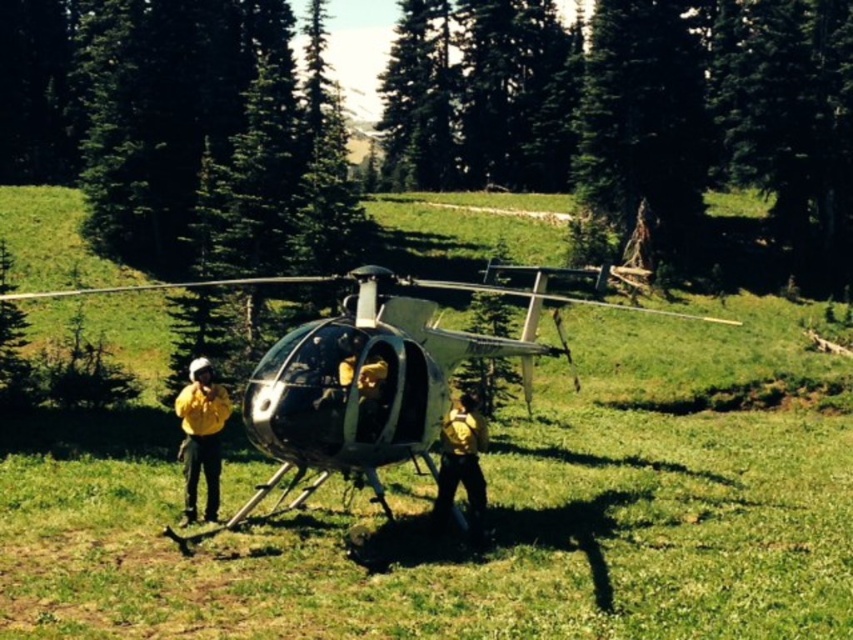
You are standing at the point labeled point (209, 493) and want to take a photo of the helicopter. If your camera has a maximum focus range of 50 feet, will you be able to capture the helicopter clearly?

The distance between point (209, 493) and the camera is 44.94 feet, which is within the camera maximum focus range of 50 feet. Therefore, you can capture the helicopter clearly.

You are a drone operator trying to land a small drone near the metallic silver helicopter at center without disturbing the yellow fireproof suit at left. Since the helicopter is positioned over the suit, where should you aim to land the drone?

The metallic silver helicopter at center is positioned over the yellow fireproof suit at left, so you should aim to land the drone on the grassy area around the helicopter but away from the area directly above the suit to avoid disturbing it.

You are a drone operator flying over the grassy field. You need to deliver a package to the metallic silver helicopter at center. However, you notice the matte yellow backpack at center is blocking the landing area. Can you land the drone safely on the helicopter?

The metallic silver helicopter at center is in front of the matte yellow backpack at center, meaning the backpack is behind the helicopter. Since the backpack is not in front of the helicopter, it is not blocking the landing area. Therefore, the drone can land safely on the metallic silver helicopter at center.